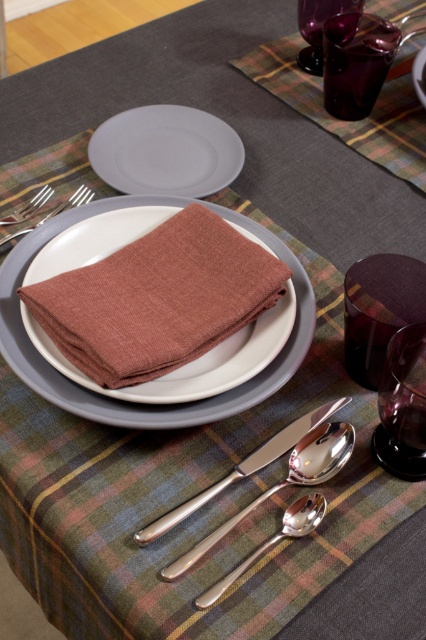
Between matte silver fork at left and matte gray plate at center, which one is positioned lower?

matte silver fork at left is lower down.

Between point (68, 200) and point (423, 99), which one is positioned in front?

Point (68, 200) is in front.

Locate an element on the screen. This screenshot has width=426, height=640. matte silver fork at left is located at coordinates (54, 211).

Is brown linen napkin at center wider than matte gray plate at center?

Correct, the width of brown linen napkin at center exceeds that of matte gray plate at center.

Who is more forward, (124, 394) or (417, 97)?

Point (124, 394) is more forward.

Identify the location of brown linen napkin at center. This screenshot has height=640, width=426. (192, 360).

Between point (302, 51) and point (52, 189), which one is positioned in front?

Point (52, 189) is in front.

Does transparent purple wine glass at upper right come in front of silver metallic fork at upper left?

No, it is behind silver metallic fork at upper left.

Identify the location of transparent purple wine glass at upper right. The image size is (426, 640). (319, 28).